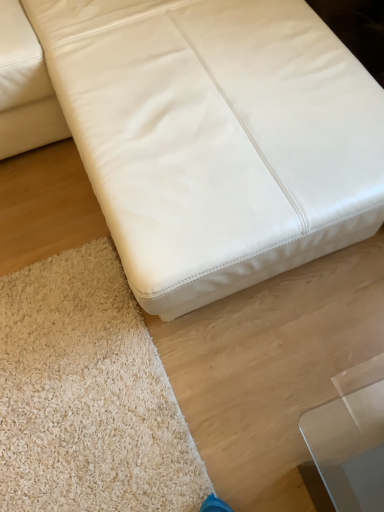
Describe the element at coordinates (216, 138) in the screenshot. I see `white leather couch at center` at that location.

This screenshot has width=384, height=512. I want to click on white leather couch at center, so click(x=216, y=138).

Measure the distance between white leather couch at center and camera.

white leather couch at center is 32.97 inches away from camera.

Find the location of a particular element. The width and height of the screenshot is (384, 512). white leather couch at center is located at coordinates (216, 138).